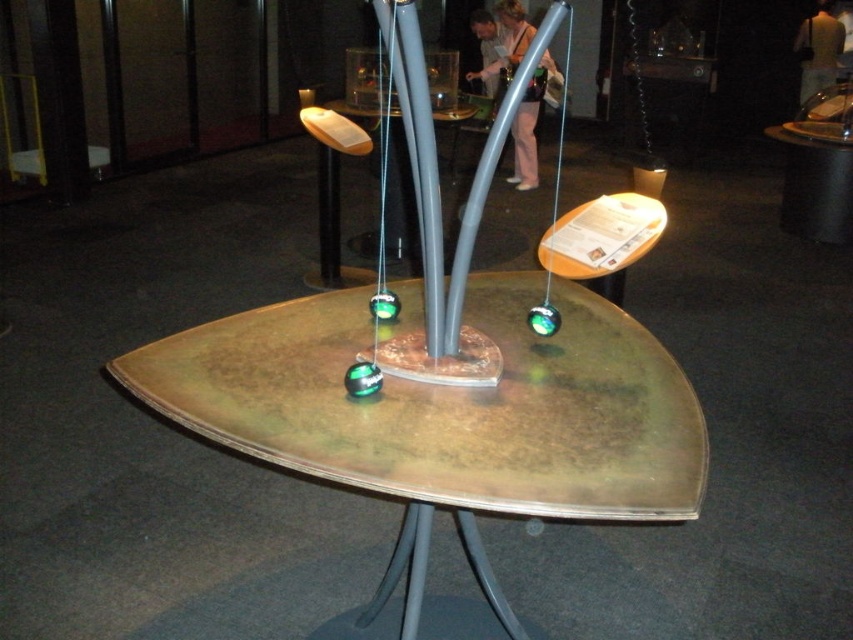
Question: Which point is farther to the camera?

Choices:
 (A) metallic gray table at center
 (B) bronze metallic table at center

Answer: (A)

Question: Can you confirm if bronze metallic table at center is wider than metallic gray table at center?

Choices:
 (A) yes
 (B) no

Answer: (A)

Question: Does bronze metallic table at center appear on the left side of metallic gray table at center?

Choices:
 (A) no
 (B) yes

Answer: (A)

Question: Can you confirm if bronze metallic table at center is smaller than metallic gray table at center?

Choices:
 (A) yes
 (B) no

Answer: (B)